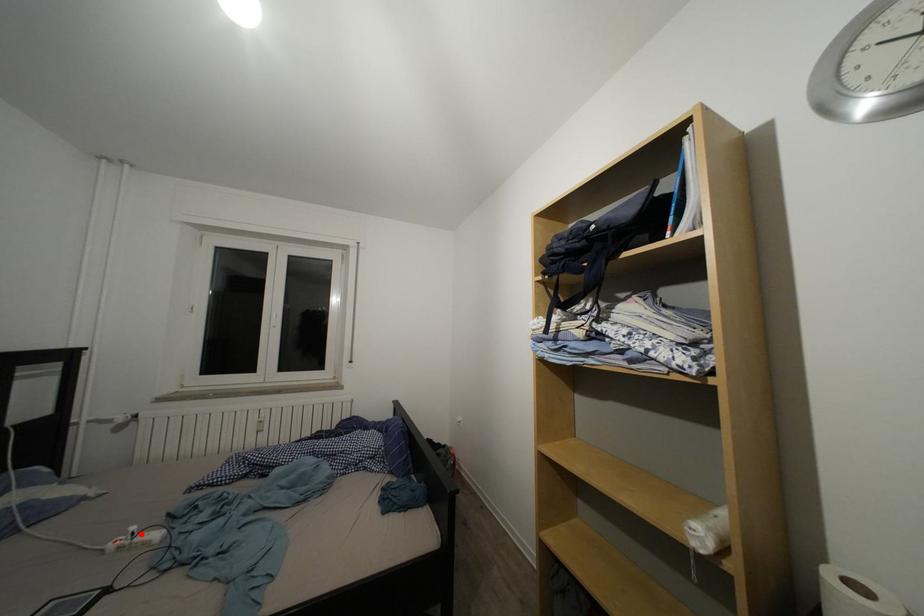
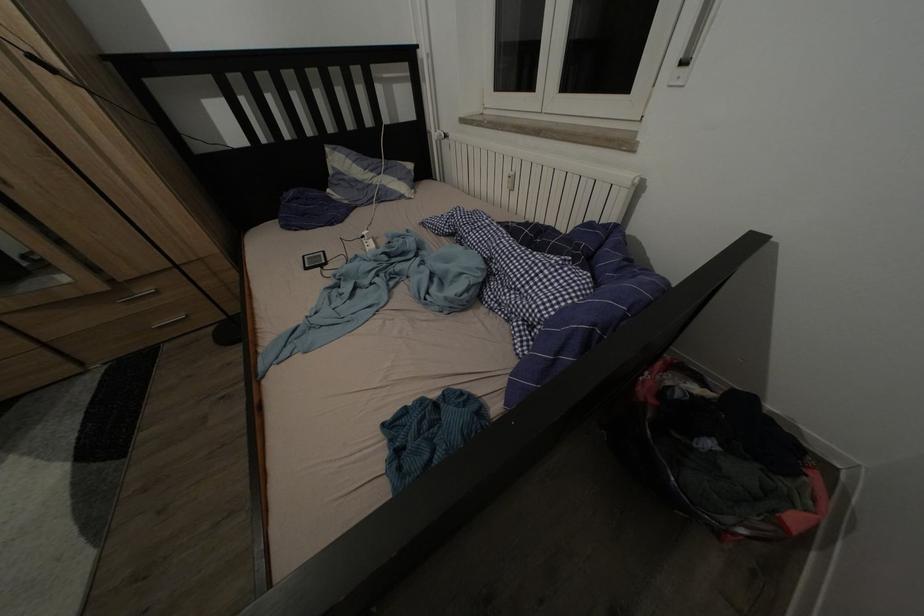
Question: A red point is marked in image1. In image2, is the corresponding 3D point closer to the camera or farther? Reply with the corresponding letter.

Choices:
 (A) The corresponding 3D point is closer.
 (B) The corresponding 3D point is farther.

Answer: (B)